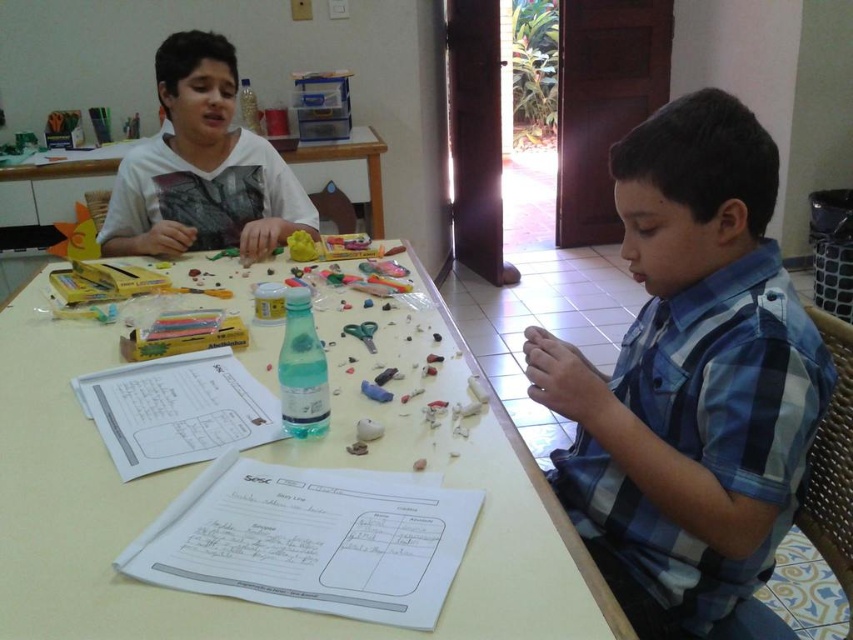
You are a photographer setting up a shoot in this scene. You need to ensure that both the blue plaid shirt at right and the white matte shirt at upper left are visible in the frame. Based on their positions, which shirt is closer to the camera?

The blue plaid shirt at right is in front of the white matte shirt at upper left, so it is closer to the camera.

You are a parent observing your children at the table. You notice a blue plaid shirt at right and a clear plastic bottle filled with blue liquid. Which object is closer to you?

The clear plastic bottle filled with blue liquid is closer to you because it is 30.62 inches away from the blue plaid shirt at right, indicating it is nearer in proximity.

Based on the coordinates provided, can you identify the object located at point (691,381) in the image?

The object located at point (691,381) is the blue plaid shirt at right.